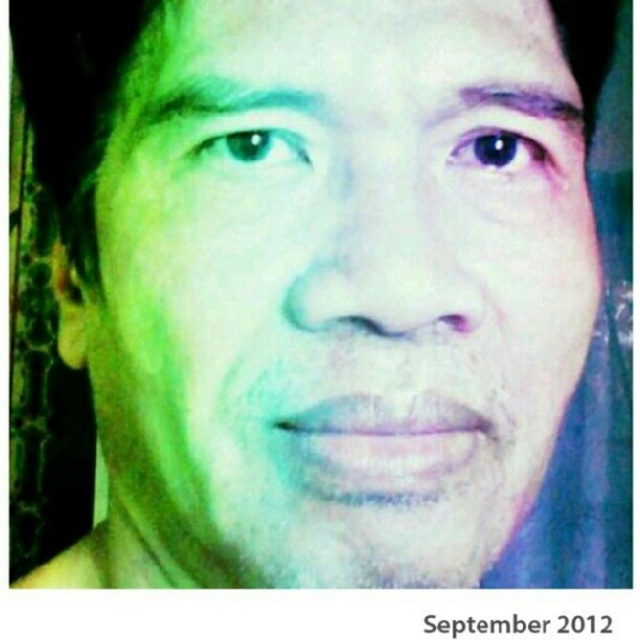
Question: Is green matte eye at upper left in front of purple matte eyebrow at upper center?

Choices:
 (A) yes
 (B) no

Answer: (A)

Question: Estimate the real-world distances between objects in this image. Which object is farther from the green matte eye at upper left?

Choices:
 (A) green matte eyebrow at upper center
 (B) green matte face at center
 (C) blue glossy eye at upper center

Answer: (C)

Question: Is green matte face at center positioned at the back of blue glossy eye at upper center?

Choices:
 (A) no
 (B) yes

Answer: (A)

Question: Can you confirm if green matte eye at upper left is bigger than purple matte eyebrow at upper center?

Choices:
 (A) yes
 (B) no

Answer: (B)

Question: Which point appears farthest from the camera in this image?

Choices:
 (A) (547, 99)
 (B) (252, 99)
 (C) (481, 125)
 (D) (460, 177)

Answer: (A)

Question: Which of the following is the farthest from the observer?

Choices:
 (A) (573, 106)
 (B) (291, 145)
 (C) (209, 113)

Answer: (A)